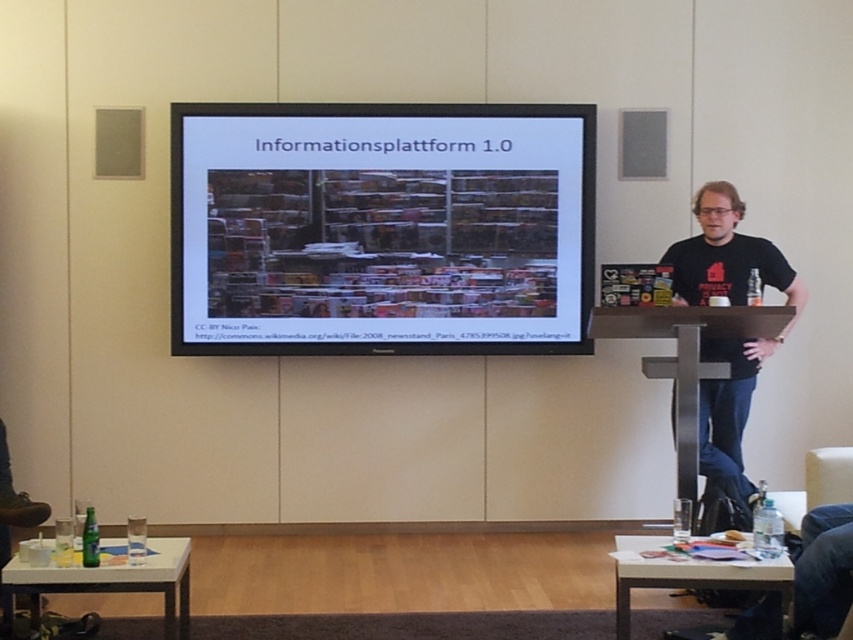
Question: Among these points, which one is nearest to the camera?

Choices:
 (A) (567, 246)
 (B) (692, 241)

Answer: (B)

Question: Does matte plastic projection screen at center have a larger size compared to black t-shirt at center?

Choices:
 (A) yes
 (B) no

Answer: (B)

Question: Is matte plastic projection screen at center positioned behind black t-shirt at center?

Choices:
 (A) yes
 (B) no

Answer: (A)

Question: Does matte plastic projection screen at center have a greater width compared to black t-shirt at center?

Choices:
 (A) no
 (B) yes

Answer: (B)